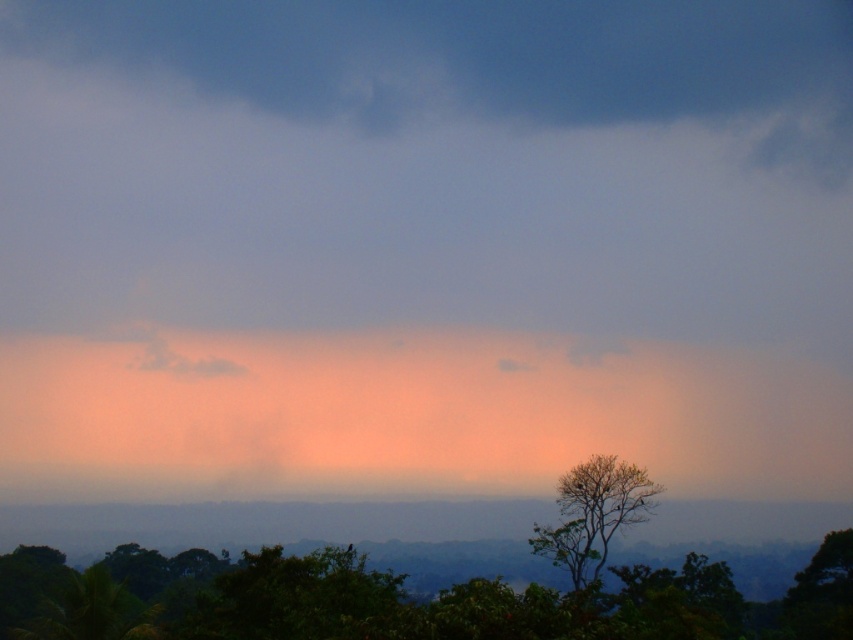
Locate an element on the screen. The image size is (853, 640). green leafy tree at lower center is located at coordinates (408, 602).

Who is taller, green leafy tree at lower center or green leafy tree at lower right?

With more height is green leafy tree at lower center.

Measure the distance between green leafy tree at lower center and camera.

green leafy tree at lower center is 225.29 feet from camera.

Locate an element on the screen. green leafy tree at lower center is located at coordinates (408, 602).